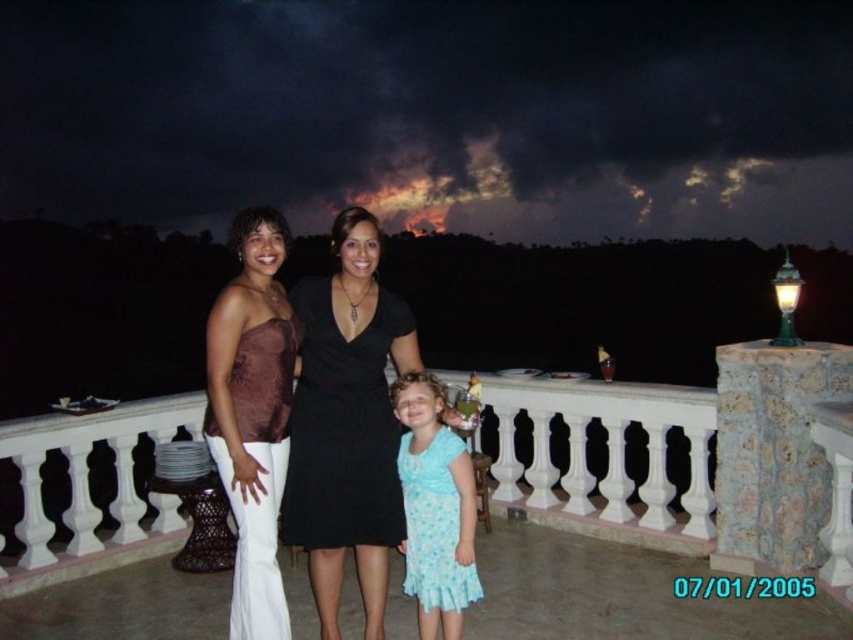
You are a photographer trying to capture a clear shot of both the matte black dress at center and the light blue fabric dress at center. Since you want both subjects in focus, which dress should you adjust your camera focus to prioritize first?

The matte black dress at center is closer to the viewer than the light blue fabric dress at center, so you should prioritize focusing on the matte black dress at center first to ensure both are in focus.

You are standing on the balcony and want to place a small potted plant on the white stone balustrade at center. However, you notice the light blue fabric dress at center is already there. Can the potted plant be placed on the balustrade without moving the dress?

The white stone balustrade at center is positioned under the light blue fabric dress at center, meaning the dress is currently occupying the balustrade. Therefore, the potted plant cannot be placed there without moving the dress.

You are an architect designing a virtual reality experience where users can interact with the scene. You need to place a virtual beacon at the exact center of the matte black dress at center. What are the coordinates where you should place the beacon?

The coordinates to place the beacon at the exact center of the matte black dress at center are point (x=306, y=419).